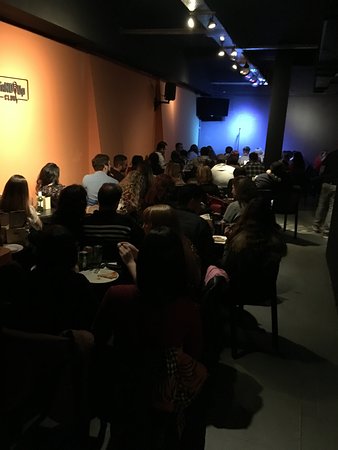
Where is `bottle`? bottle is located at coordinates (38, 203).